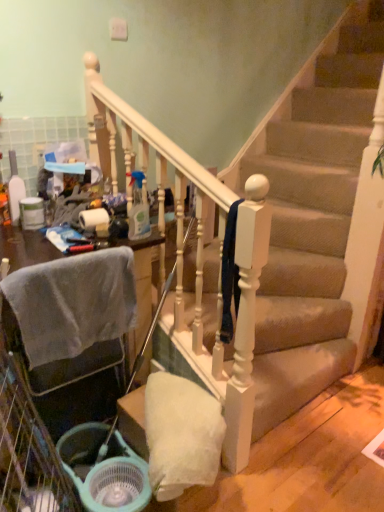
Question: Is clear plastic spray bottle at center, which ranks as the second bottle in left-to-right order, at the left side of white glossy toilet paper at upper left?

Choices:
 (A) no
 (B) yes

Answer: (A)

Question: Is clear plastic spray bottle at center, which ranks as the second bottle in left-to-right order, shorter than white glossy toilet paper at upper left?

Choices:
 (A) no
 (B) yes

Answer: (A)

Question: Is clear plastic spray bottle at center, the 1th bottle in the right-to-left sequence, oriented towards white glossy toilet paper at upper left?

Choices:
 (A) no
 (B) yes

Answer: (A)

Question: Does clear plastic spray bottle at center, the 1th bottle in the right-to-left sequence, have a greater height compared to white glossy toilet paper at upper left?

Choices:
 (A) yes
 (B) no

Answer: (A)

Question: Is clear plastic spray bottle at center, the 1th bottle in the right-to-left sequence, outside white glossy toilet paper at upper left?

Choices:
 (A) no
 (B) yes

Answer: (B)

Question: Does point (96, 445) appear closer or farther from the camera than point (129, 216)?

Choices:
 (A) farther
 (B) closer

Answer: (B)

Question: Considering the positions of light blue plastic shopping basket at lower left and clear plastic spray bottle at center, which ranks as the second bottle in left-to-right order, in the image, is light blue plastic shopping basket at lower left bigger or smaller than clear plastic spray bottle at center, which ranks as the second bottle in left-to-right order,?

Choices:
 (A) small
 (B) big

Answer: (B)

Question: Is light blue plastic shopping basket at lower left situated inside clear plastic spray bottle at center, the 1th bottle in the right-to-left sequence, or outside?

Choices:
 (A) outside
 (B) inside

Answer: (A)

Question: Is light blue plastic shopping basket at lower left in front of or behind clear plastic spray bottle at center, which ranks as the second bottle in left-to-right order, in the image?

Choices:
 (A) front
 (B) behind

Answer: (A)

Question: Is white glossy toilet paper at upper left situated inside clear plastic spray bottle at center, the 1th bottle in the right-to-left sequence, or outside?

Choices:
 (A) outside
 (B) inside

Answer: (A)

Question: From a real-world perspective, is white glossy toilet paper at upper left physically located above or below clear plastic spray bottle at center, the 1th bottle in the right-to-left sequence?

Choices:
 (A) below
 (B) above

Answer: (A)

Question: In terms of height, does white glossy toilet paper at upper left look taller or shorter compared to clear plastic spray bottle at center, which ranks as the second bottle in left-to-right order?

Choices:
 (A) tall
 (B) short

Answer: (B)

Question: Does point (x=81, y=220) appear closer or farther from the camera than point (x=142, y=178)?

Choices:
 (A) farther
 (B) closer

Answer: (B)

Question: In terms of height, does white glossy toilet paper at upper left look taller or shorter compared to light blue plastic shopping basket at lower left?

Choices:
 (A) short
 (B) tall

Answer: (A)

Question: Does point (105, 221) appear closer or farther from the camera than point (135, 510)?

Choices:
 (A) farther
 (B) closer

Answer: (A)